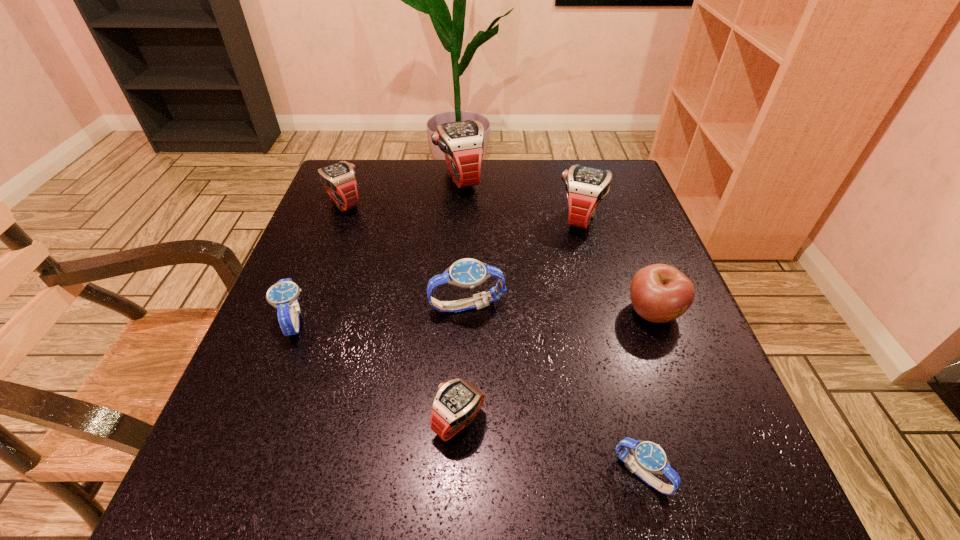
Select which object is the seventh closest to the apple. Please provide its 2D coordinates. Your answer should be formatted as a tuple, i.e. [(x, y)], where the tuple contains the x and y coordinates of a point satisfying the conditions above.

[(339, 179)]

Image resolution: width=960 pixels, height=540 pixels. Identify the location of the fifth closest watch to the leftmost blue watch. (586, 187).

Identify which watch is the second nearest to the second smallest red watch. Please provide its 2D coordinates. Your answer should be formatted as a tuple, i.e. [(x, y)], where the tuple contains the x and y coordinates of a point satisfying the conditions above.

[(283, 295)]

The height and width of the screenshot is (540, 960). Identify the location of red watch identified as the fourth closest to the shortest watch. (339, 179).

Point out which red watch is positioned as the second nearest to the smallest red watch. Please provide its 2D coordinates. Your answer should be formatted as a tuple, i.e. [(x, y)], where the tuple contains the x and y coordinates of a point satisfying the conditions above.

[(339, 179)]

At what (x,y) coordinates should I click in order to perform the action: click on blue watch that is the closest to the apple. Please return your answer as a coordinate pair (x, y). This screenshot has height=540, width=960. Looking at the image, I should click on (649, 457).

Choose which blue watch is the second nearest neighbor to the rightmost red watch. Please provide its 2D coordinates. Your answer should be formatted as a tuple, i.e. [(x, y)], where the tuple contains the x and y coordinates of a point satisfying the conditions above.

[(649, 457)]